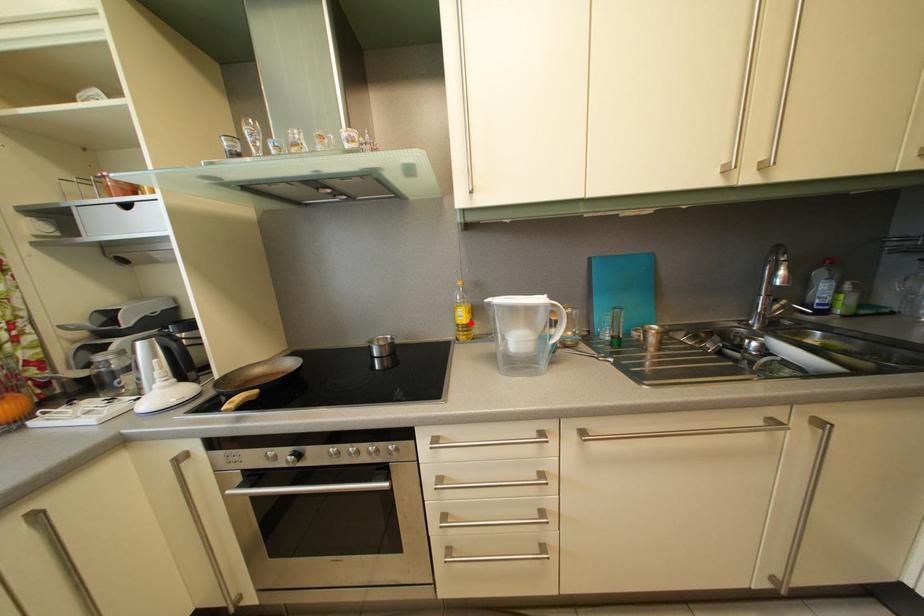
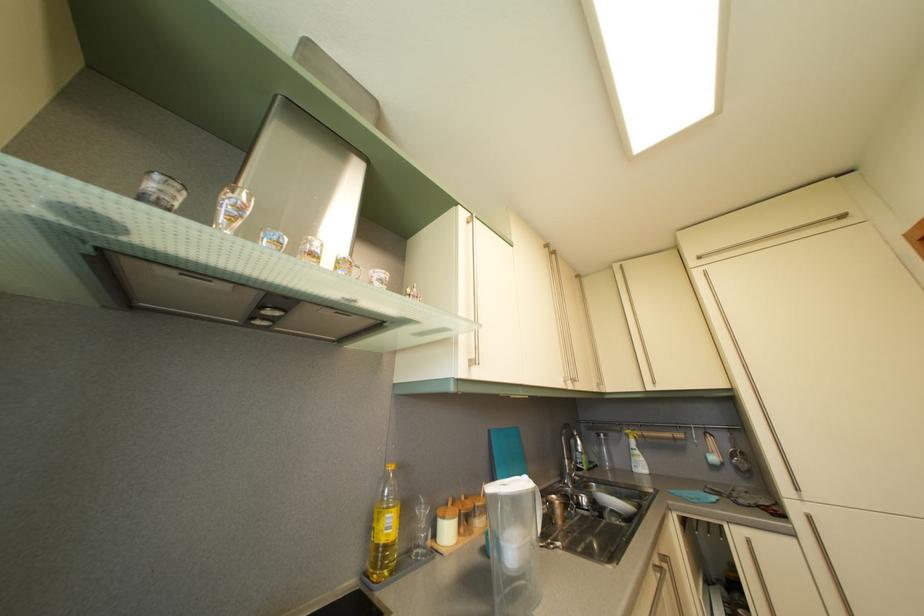
Where in the second image is the point corresponding to the highlighted location from the first image?

(396, 533)